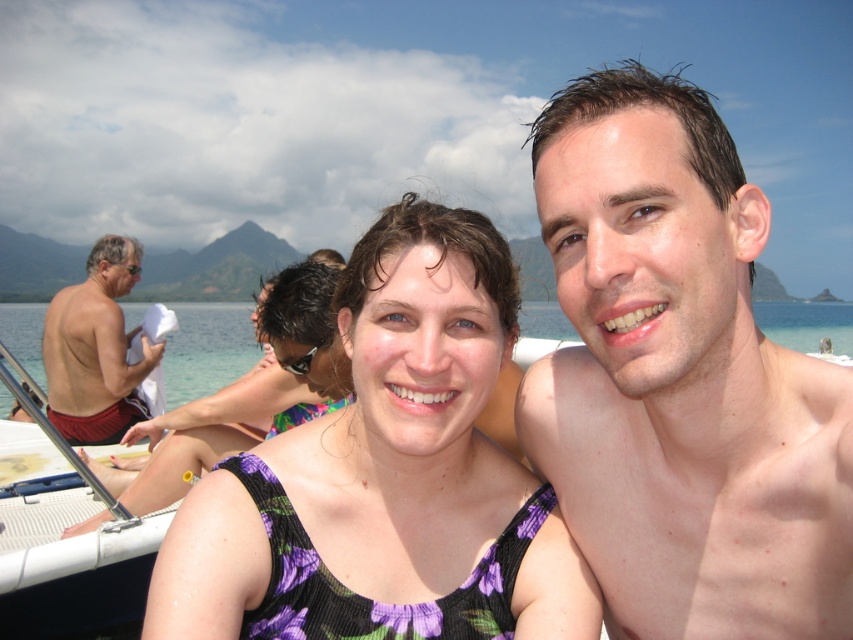
Question: Estimate the real-world distances between objects in this image. Which object is closer to the purple floral tank top at center?

Choices:
 (A) pale skin at center
 (B) purple floral swimsuit at center
 (C) shiny red shorts at left

Answer: (A)

Question: Observing the image, what is the correct spatial positioning of pale skin at center in reference to purple floral swimsuit at center?

Choices:
 (A) below
 (B) above

Answer: (B)

Question: Is purple floral swimsuit at center thinner than clear blue water at center?

Choices:
 (A) yes
 (B) no

Answer: (A)

Question: Which point is farther to the camera?

Choices:
 (A) (97, 349)
 (B) (602, 588)
 (C) (502, 358)

Answer: (A)

Question: Which object is farther from the camera taking this photo?

Choices:
 (A) purple floral tank top at center
 (B) shiny red shorts at left

Answer: (B)

Question: Does purple floral tank top at center appear over purple floral swimsuit at center?

Choices:
 (A) yes
 (B) no

Answer: (B)